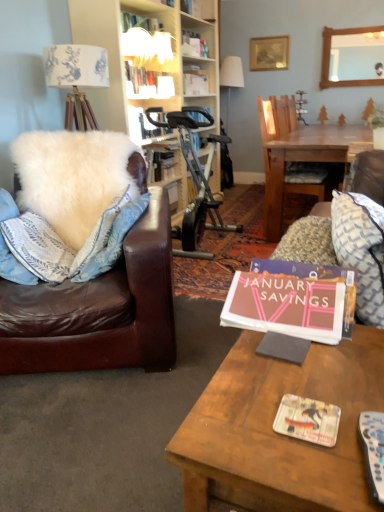
Identify the location of vacant area to the left of white plastic remote control at lower right. This screenshot has height=512, width=384. (296, 447).